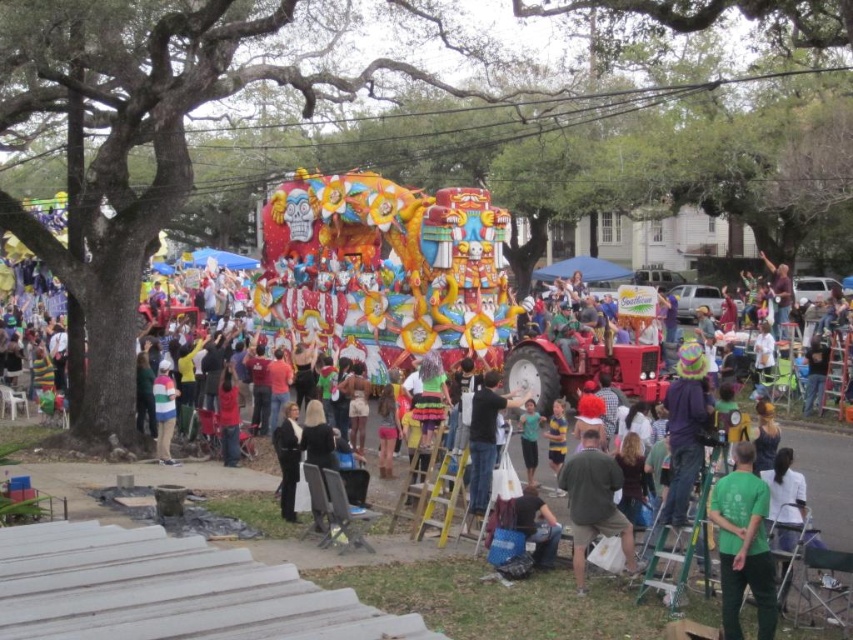
You are standing at the origin point in the image and want to move towards the black leather pants at lower center. What direction should you move in to reach them?

The black leather pants at lower center are located at point 0.717 on the x axis and 0.338 on the y axis. Since you are at the origin point, you should move towards the right and slightly upwards to reach them.

You are a photographer at the event and want to capture a photo of the green cotton shirt at center and dark blue jeans at center. Which clothing item appears narrower in the photo?

The green cotton shirt at center is thinner than dark blue jeans at center, so the green cotton shirt at center appears narrower in the photo.